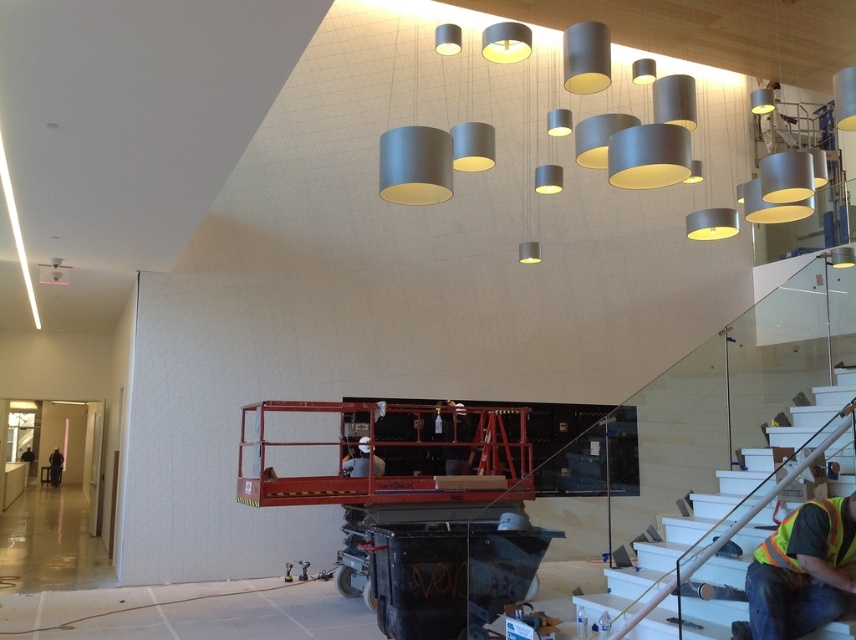
Does white glossy stair at lower right appear under reflective safety vest at lower right?

Incorrect, white glossy stair at lower right is not positioned below reflective safety vest at lower right.

Does point (682, 557) come behind point (827, 620)?

That is True.

Locate an element on the screen. The height and width of the screenshot is (640, 856). white glossy stair at lower right is located at coordinates (733, 522).

Image resolution: width=856 pixels, height=640 pixels. I want to click on reflective safety vest at lower right, so click(801, 572).

Can you confirm if reflective safety vest at lower right is positioned to the right of dark gray uniform at lower left?

Correct, you'll find reflective safety vest at lower right to the right of dark gray uniform at lower left.

Which is behind, point (807, 532) or point (62, 461)?

Point (62, 461)

Identify the location of reflective safety vest at lower right. The width and height of the screenshot is (856, 640). (801, 572).

This screenshot has width=856, height=640. I want to click on white glossy stair at lower right, so click(x=733, y=522).

Does white glossy stair at lower right have a greater height compared to dark gray uniform at lower left?

Correct, white glossy stair at lower right is much taller as dark gray uniform at lower left.

Which is in front, point (813, 422) or point (49, 456)?

Point (813, 422)

Identify the location of white glossy stair at lower right. (733, 522).